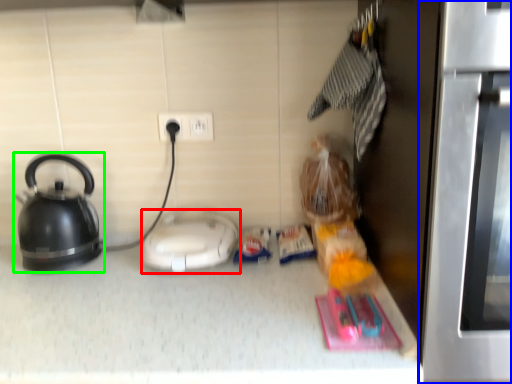
Question: Which is nearer to the appliance (highlighted by a red box)? oven (highlighted by a blue box) or kettle (highlighted by a green box).

Choices:
 (A) oven
 (B) kettle

Answer: (B)